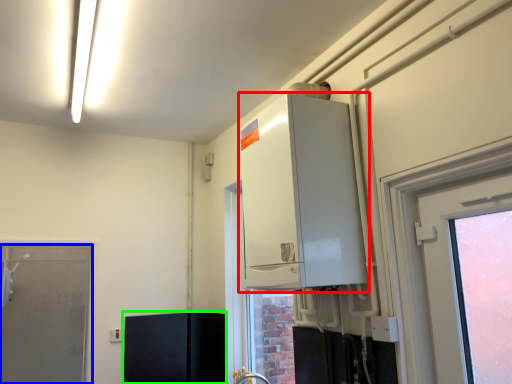
Question: Considering the real-world distances, which object is closest to appliance (highlighted by a red box)? door (highlighted by a blue box) or cabinetry (highlighted by a green box).

Choices:
 (A) door
 (B) cabinetry

Answer: (B)